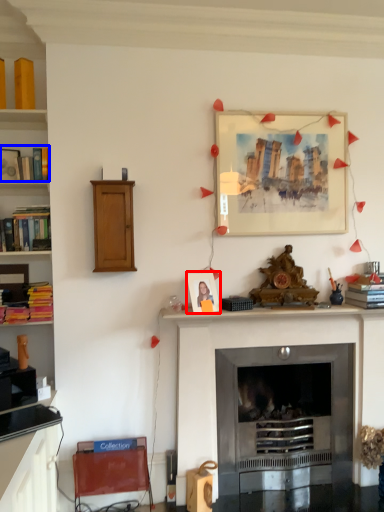
Question: Which point is closer to the camera, picture frame (highlighted by a red box) or book (highlighted by a blue box)?

Choices:
 (A) picture frame
 (B) book

Answer: (A)